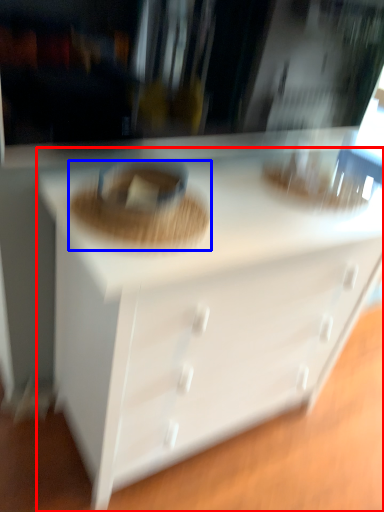
Question: Among these objects, which one is nearest to the camera, chest of drawers (highlighted by a red box) or food (highlighted by a blue box)?

Choices:
 (A) chest of drawers
 (B) food

Answer: (A)